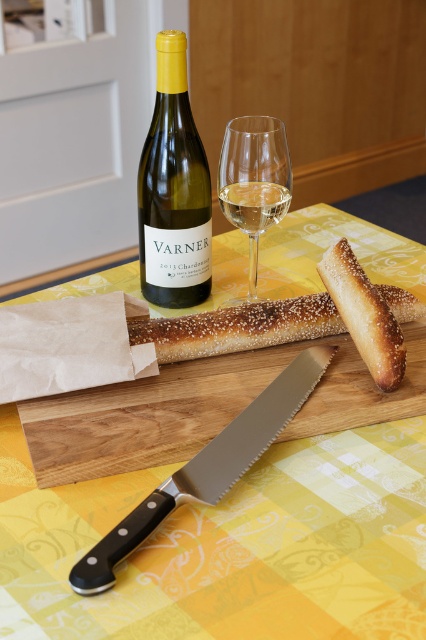
Does clear glass wine glass at upper center appear on the left side of clear glass wine at upper center?

Correct, you'll find clear glass wine glass at upper center to the left of clear glass wine at upper center.

Who is higher up, clear glass wine glass at upper center or clear glass wine at upper center?

clear glass wine at upper center

Between point (235, 189) and point (221, 208), which one is positioned in front?

Point (235, 189)

Where is `clear glass wine glass at upper center`? The width and height of the screenshot is (426, 640). clear glass wine glass at upper center is located at coordinates (253, 182).

Can you confirm if matte yellow glass bottle at upper left is positioned to the left of serrated silver knife at center?

Yes, matte yellow glass bottle at upper left is to the left of serrated silver knife at center.

Does point (170, 67) come farther from viewer compared to point (261, 440)?

Yes, it is.

Who is more forward, (176, 298) or (238, 438)?

Point (238, 438)

Find the location of `matte yellow glass bottle at upper left`. matte yellow glass bottle at upper left is located at coordinates (173, 189).

Who is more distant from viewer, (88, 472) or (238, 344)?

Point (238, 344)

Can you confirm if wooden cutting board at center is wider than sesame seed crust baguette at center?

Correct, the width of wooden cutting board at center exceeds that of sesame seed crust baguette at center.

Is point (293, 342) farther from camera compared to point (396, 285)?

No.

At what (x,y) coordinates should I click in order to perform the action: click on wooden cutting board at center. Please return your answer as a coordinate pair (x, y). The width and height of the screenshot is (426, 640). Looking at the image, I should click on (204, 408).